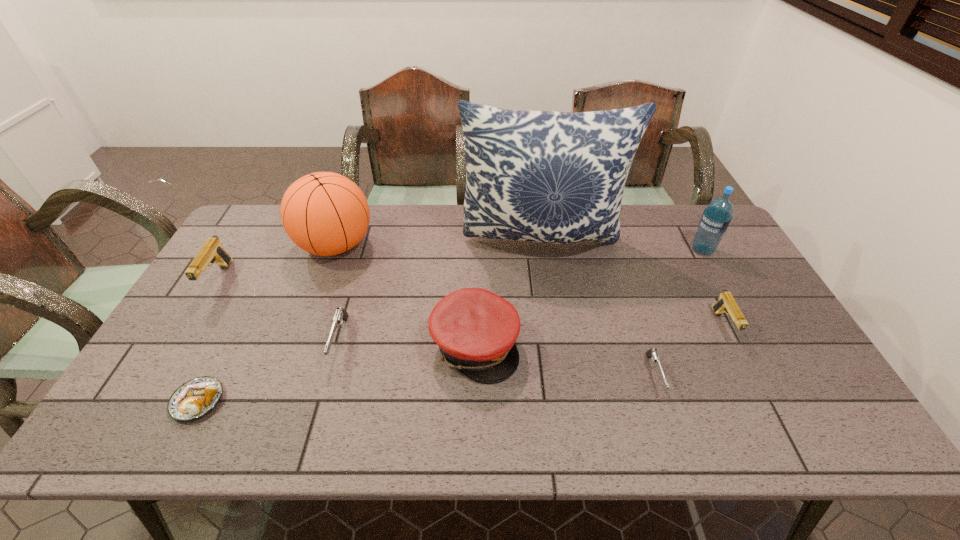
In order to click on free space that satisfies the following two spatial constraints: 1. at the barrel of the leftmost pistol; 2. on the right side of the shortest object in this screenshot , I will do `click(144, 401)`.